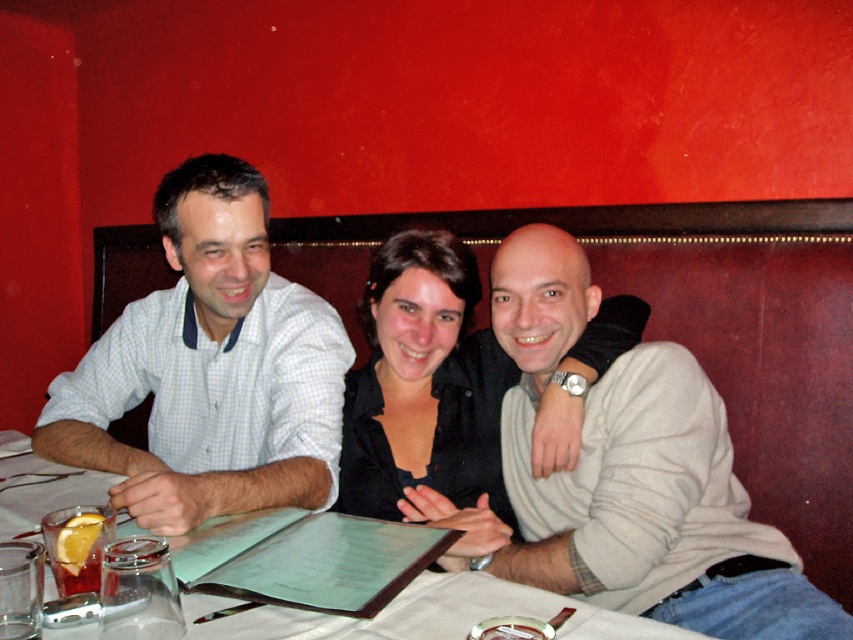
Question: In this image, where is light gray sweater at center located relative to black matte shirt at center?

Choices:
 (A) above
 (B) below

Answer: (B)

Question: Estimate the real-world distances between objects in this image. Which object is closer to the black matte shirt at center?

Choices:
 (A) white paper menu at center
 (B) light gray sweater at center
 (C) white checkered shirt at left

Answer: (B)

Question: Can you confirm if light gray sweater at center is positioned to the left of white checkered shirt at left?

Choices:
 (A) no
 (B) yes

Answer: (A)

Question: Is light gray sweater at center thinner than white checkered shirt at left?

Choices:
 (A) yes
 (B) no

Answer: (A)

Question: Based on their relative distances, which object is farther from the light gray sweater at center?

Choices:
 (A) white paper menu at center
 (B) black matte shirt at center

Answer: (A)

Question: Which point is farther from the camera taking this photo?

Choices:
 (A) (36, 506)
 (B) (309, 410)
 (C) (421, 253)

Answer: (C)